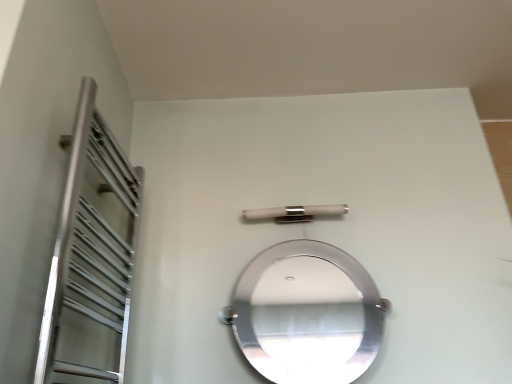
Question: Would you say polished silver mirror at center is a long distance from satin nickel bar at center?

Choices:
 (A) no
 (B) yes

Answer: (B)

Question: Considering the relative sizes of polished silver mirror at center and satin nickel bar at center in the image provided, is polished silver mirror at center taller than satin nickel bar at center?

Choices:
 (A) yes
 (B) no

Answer: (A)

Question: Is polished silver mirror at center smaller than satin nickel bar at center?

Choices:
 (A) no
 (B) yes

Answer: (A)

Question: Does polished silver mirror at center have a greater width compared to satin nickel bar at center?

Choices:
 (A) no
 (B) yes

Answer: (B)

Question: Considering the relative positions of polished silver mirror at center and satin nickel bar at center in the image provided, is polished silver mirror at center to the right of satin nickel bar at center from the viewer's perspective?

Choices:
 (A) yes
 (B) no

Answer: (A)

Question: Is polished silver mirror at center outside satin nickel bar at center?

Choices:
 (A) no
 (B) yes

Answer: (B)

Question: Is silver metallic towel rack at left taller than satin nickel bar at center?

Choices:
 (A) yes
 (B) no

Answer: (A)

Question: From the image's perspective, is silver metallic towel rack at left over satin nickel bar at center?

Choices:
 (A) yes
 (B) no

Answer: (B)

Question: Can you confirm if silver metallic towel rack at left is wider than satin nickel bar at center?

Choices:
 (A) no
 (B) yes

Answer: (B)

Question: Does silver metallic towel rack at left appear on the right side of satin nickel bar at center?

Choices:
 (A) no
 (B) yes

Answer: (A)

Question: Is silver metallic towel rack at left turned away from satin nickel bar at center?

Choices:
 (A) no
 (B) yes

Answer: (A)

Question: Is the depth of silver metallic towel rack at left greater than that of satin nickel bar at center?

Choices:
 (A) no
 (B) yes

Answer: (A)

Question: Can you confirm if satin nickel bar at center is taller than polished silver mirror at center?

Choices:
 (A) no
 (B) yes

Answer: (A)